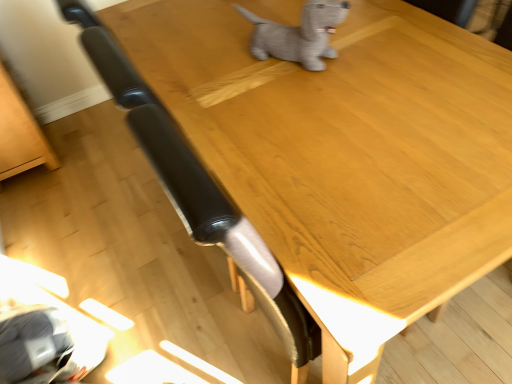
The image size is (512, 384). In order to click on free space to the left of gray plush dog at upper center in this screenshot , I will do `click(219, 77)`.